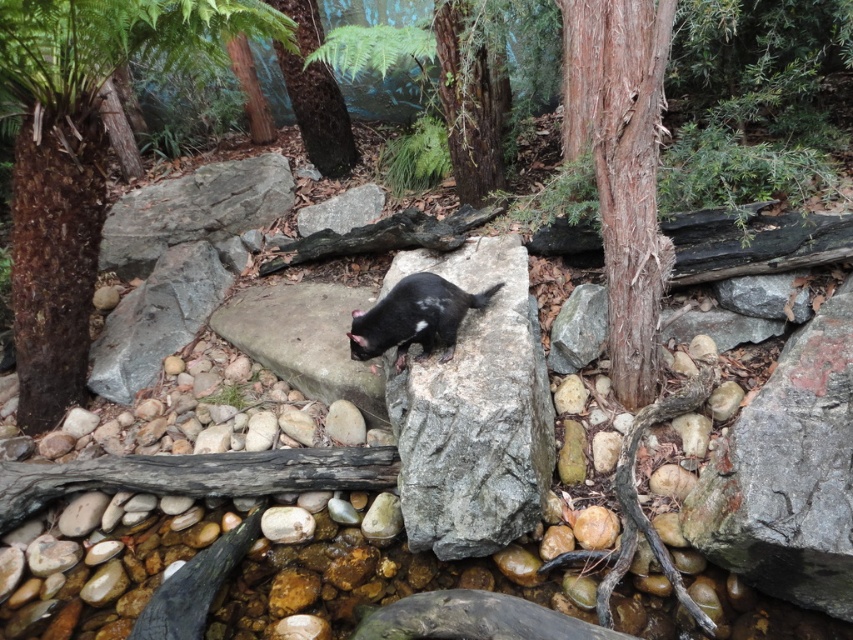
Question: Does brown rough tree at center come in front of brown rough bark tree at center right?

Choices:
 (A) no
 (B) yes

Answer: (A)

Question: Which point is closer to the camera?

Choices:
 (A) (49, 380)
 (B) (670, 244)
 (C) (403, 288)

Answer: (B)

Question: Estimate the real-world distances between objects in this image. Which object is closer to the brown rough bark tree at upper center?

Choices:
 (A) brown rough tree at center
 (B) brown rough bark tree at center right
 (C) brown rough tree trunk at upper center
 (D) black furry tasmanian devil at center

Answer: (D)

Question: Does black furry tasmanian devil at center appear over brown rough tree trunk at upper center?

Choices:
 (A) yes
 (B) no

Answer: (B)

Question: Is brown rough bark tree at upper center further to the viewer compared to black furry tasmanian devil at center?

Choices:
 (A) yes
 (B) no

Answer: (A)

Question: Which point is closer to the camera taking this photo?

Choices:
 (A) (490, 134)
 (B) (351, 330)
 (C) (654, 132)

Answer: (C)